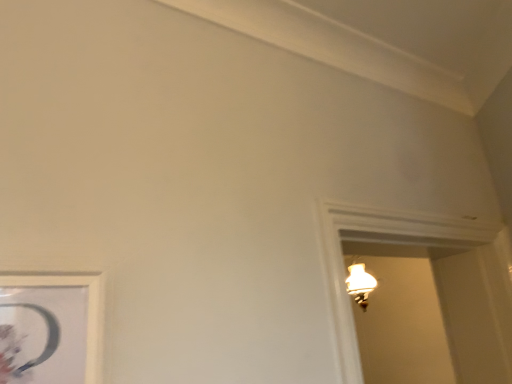
Question: Should I look upward or downward to see white matte picture frame at lower left?

Choices:
 (A) down
 (B) up

Answer: (A)